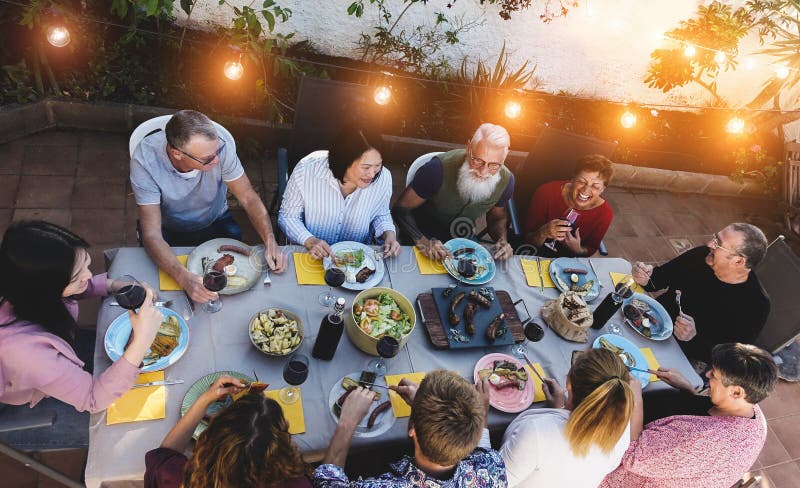
I want to click on silverware that's not in use, so click(x=166, y=378), click(x=168, y=299), click(x=269, y=282), click(x=192, y=308), click(x=541, y=273).